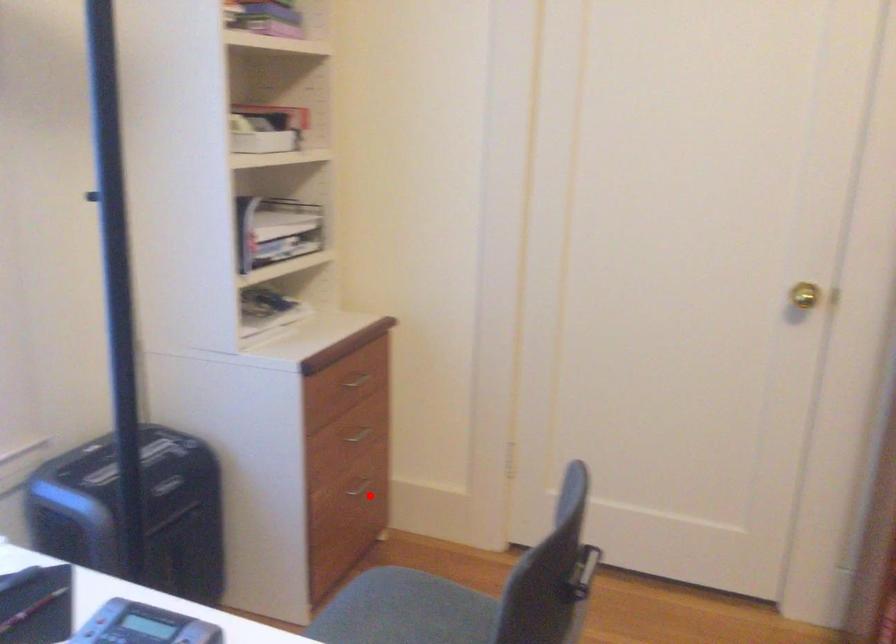
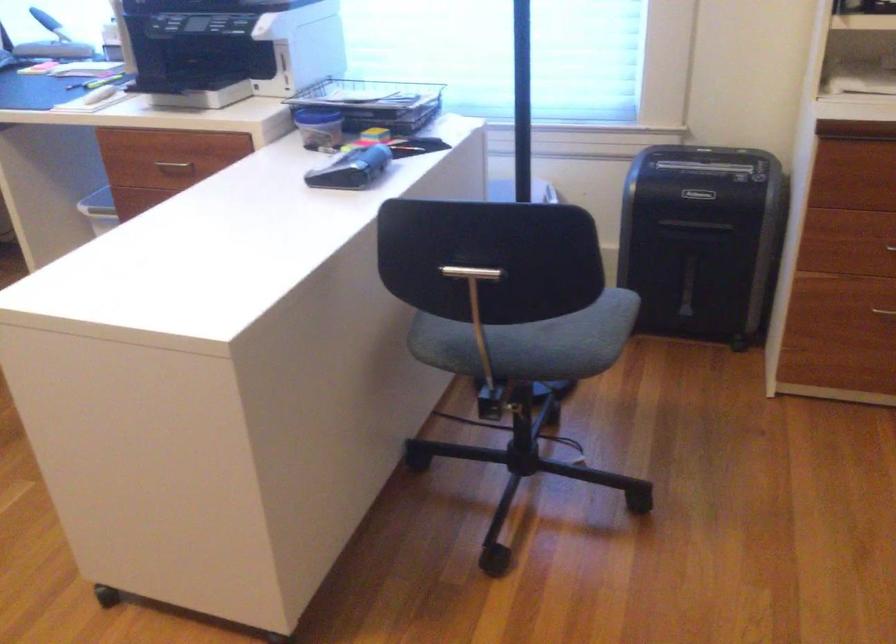
Locate, in the second image, the point that corresponds to the highlighted location in the first image.

(883, 313)